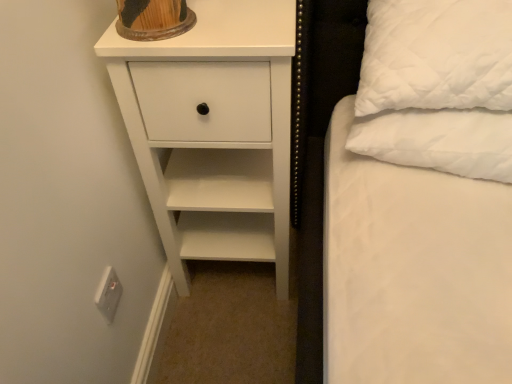
This screenshot has height=384, width=512. Describe the element at coordinates (108, 294) in the screenshot. I see `white plastic electric outlet at lower left` at that location.

Measure the distance between white quilted pillow at right and camera.

31.59 inches.

Image resolution: width=512 pixels, height=384 pixels. Describe the element at coordinates (213, 131) in the screenshot. I see `white matte chest of drawers at upper left` at that location.

At what (x,y) coordinates should I click in order to perform the action: click on white plastic electric outlet at lower left. Please return your answer as a coordinate pair (x, y). Looking at the image, I should click on (108, 294).

Considering the sizes of objects white matte chest of drawers at upper left and white plastic electric outlet at lower left in the image provided, who is bigger, white matte chest of drawers at upper left or white plastic electric outlet at lower left?

white matte chest of drawers at upper left is bigger.

There is a white plastic electric outlet at lower left. At what (x,y) coordinates should I click in order to perform the action: click on the chest of drawers above it (from a real-world perspective). Please return your answer as a coordinate pair (x, y). The height and width of the screenshot is (384, 512). Looking at the image, I should click on (213, 131).

Can you tell me how much white matte chest of drawers at upper left and white plastic electric outlet at lower left differ in facing direction?

The facing directions of white matte chest of drawers at upper left and white plastic electric outlet at lower left are 88.9 degrees apart.

Who is taller, white matte chest of drawers at upper left or white plastic electric outlet at lower left?

white matte chest of drawers at upper left is taller.

Considering the relative positions of white quilted pillow at right and white matte chest of drawers at upper left in the image provided, is white quilted pillow at right to the right of white matte chest of drawers at upper left from the viewer's perspective?

Yes.

Is white quilted pillow at right positioned far away from white matte chest of drawers at upper left?

No.

From a real-world perspective, is white quilted pillow at right physically above white matte chest of drawers at upper left?

Yes, from a real-world perspective, white quilted pillow at right is above white matte chest of drawers at upper left.

Does white quilted pillow at right have a greater width compared to white matte chest of drawers at upper left?

No.

Considering the sizes of objects white plastic electric outlet at lower left and white matte chest of drawers at upper left in the image provided, who is wider, white plastic electric outlet at lower left or white matte chest of drawers at upper left?

With larger width is white matte chest of drawers at upper left.

Locate an element on the screen. This screenshot has height=384, width=512. the chest of drawers that appears above the white plastic electric outlet at lower left (from the image's perspective) is located at coordinates (213, 131).

Between white plastic electric outlet at lower left and white matte chest of drawers at upper left, which one appears on the right side from the viewer's perspective?

white matte chest of drawers at upper left is more to the right.

Can you confirm if white plastic electric outlet at lower left is thinner than white quilted pillow at right?

Correct, the width of white plastic electric outlet at lower left is less than that of white quilted pillow at right.

What are the coordinates of `pillow above the white plastic electric outlet at lower left (from a real-world perspective)` in the screenshot? It's located at (436, 56).

How different are the orientations of white plastic electric outlet at lower left and white quilted pillow at right in degrees?

The facing directions of white plastic electric outlet at lower left and white quilted pillow at right are 88.1 degrees apart.

Based on the photo, is the position of white plastic electric outlet at lower left less distant than that of white quilted pillow at right?

No, it is behind white quilted pillow at right.

Considering the relative sizes of white quilted pillow at right and white plastic electric outlet at lower left in the image provided, is white quilted pillow at right taller than white plastic electric outlet at lower left?

Yes, white quilted pillow at right is taller than white plastic electric outlet at lower left.

Considering the points (435, 6) and (106, 288), which point is behind, point (435, 6) or point (106, 288)?

The point (435, 6) is farther.

How many degrees apart are the facing directions of white quilted pillow at right and white plastic electric outlet at lower left?

The angle between the facing direction of white quilted pillow at right and the facing direction of white plastic electric outlet at lower left is 88.1 degrees.

The image size is (512, 384). I want to click on electric outlet that appears behind the white quilted pillow at right, so click(108, 294).

Considering the sizes of objects white matte chest of drawers at upper left and white quilted pillow at right in the image provided, who is shorter, white matte chest of drawers at upper left or white quilted pillow at right?

white quilted pillow at right is shorter.

Is white matte chest of drawers at upper left placed right next to white quilted pillow at right?

No, white matte chest of drawers at upper left is not making contact with white quilted pillow at right.

Does white matte chest of drawers at upper left have a lesser width compared to white quilted pillow at right?

In fact, white matte chest of drawers at upper left might be wider than white quilted pillow at right.

The height and width of the screenshot is (384, 512). I want to click on electric outlet that appears behind the white matte chest of drawers at upper left, so click(x=108, y=294).

Where is `pillow to the right of white matte chest of drawers at upper left`? The width and height of the screenshot is (512, 384). pillow to the right of white matte chest of drawers at upper left is located at coordinates (436, 56).

Which object lies nearer to the anchor point white matte chest of drawers at upper left, white plastic electric outlet at lower left or white quilted pillow at right?

Based on the image, white quilted pillow at right appears to be nearer to white matte chest of drawers at upper left.

Looking at the image, which one is located further to white matte chest of drawers at upper left, white quilted pillow at right or white plastic electric outlet at lower left?

The object further to white matte chest of drawers at upper left is white plastic electric outlet at lower left.

Looking at the image, which one is located further to white quilted pillow at right, white plastic electric outlet at lower left or white matte chest of drawers at upper left?

Based on the image, white plastic electric outlet at lower left appears to be further to white quilted pillow at right.

Based on their spatial positions, is white matte chest of drawers at upper left or white plastic electric outlet at lower left further from white quilted pillow at right?

white plastic electric outlet at lower left is positioned further to the anchor white quilted pillow at right.

When comparing their distances from white plastic electric outlet at lower left, does white matte chest of drawers at upper left or white quilted pillow at right seem closer?

white matte chest of drawers at upper left lies closer to white plastic electric outlet at lower left than the other object.

Considering their positions, is white quilted pillow at right positioned further to white plastic electric outlet at lower left than white matte chest of drawers at upper left?

white quilted pillow at right is further to white plastic electric outlet at lower left.

The height and width of the screenshot is (384, 512). I want to click on chest of drawers between white plastic electric outlet at lower left and white quilted pillow at right from left to right, so click(213, 131).